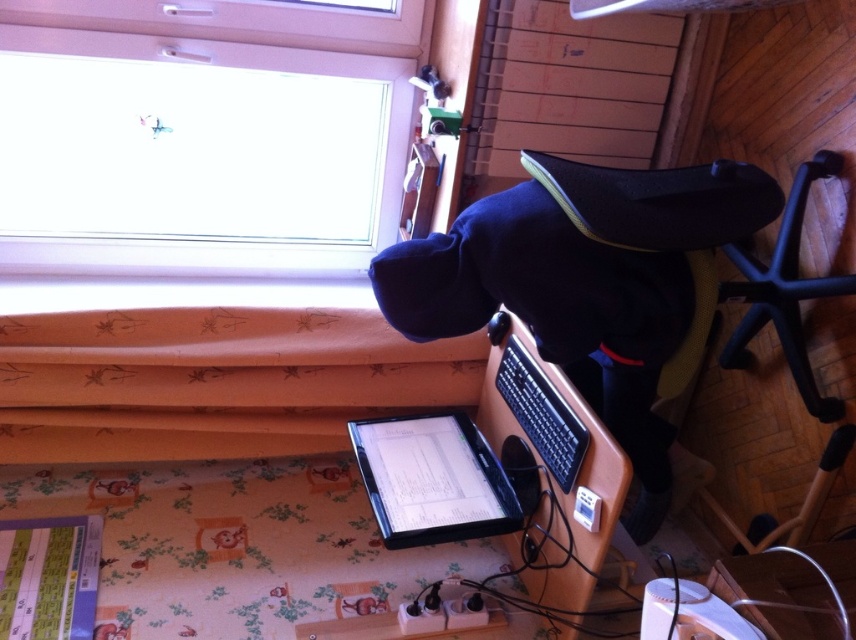
Question: Which of the following is the closest to the observer?

Choices:
 (A) transparent glass window at upper left
 (B) black fleece jacket at center

Answer: (B)

Question: Does black fleece jacket at center come in front of black matte laptop at center?

Choices:
 (A) yes
 (B) no

Answer: (A)

Question: Based on their relative distances, which object is nearer to the black matte laptop at center?

Choices:
 (A) black fleece jacket at center
 (B) satin black laptop at center
 (C) transparent glass window at upper left

Answer: (B)

Question: Among these points, which one is nearest to the camera?

Choices:
 (A) (693, 276)
 (B) (443, 541)

Answer: (A)

Question: Can you confirm if black fleece jacket at center is positioned to the left of black matte laptop at center?

Choices:
 (A) yes
 (B) no

Answer: (B)

Question: Does black fleece jacket at center appear over black matte laptop at center?

Choices:
 (A) yes
 (B) no

Answer: (A)